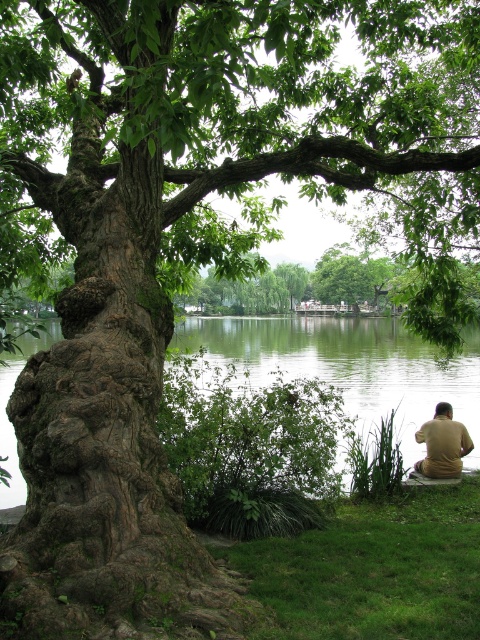
Question: Based on their relative distances, which object is nearer to the brown wooden bench at lower right?

Choices:
 (A) green grass at lower right
 (B) brown cotton shirt at lower right
 (C) green liquid water at center

Answer: (B)

Question: Which object is positioned closest to the brown cotton shirt at lower right?

Choices:
 (A) green grass at lower right
 (B) green liquid water at center
 (C) brown wooden bench at lower right

Answer: (C)

Question: Does green grass at lower right have a greater width compared to brown cotton shirt at lower right?

Choices:
 (A) yes
 (B) no

Answer: (A)

Question: Is green liquid water at center closer to camera compared to brown cotton shirt at lower right?

Choices:
 (A) yes
 (B) no

Answer: (B)

Question: Observing the image, what is the correct spatial positioning of green grass at lower right in reference to brown cotton shirt at lower right?

Choices:
 (A) below
 (B) above

Answer: (A)

Question: Which point is farther to the camera?

Choices:
 (A) green grass at lower right
 (B) brown wooden bench at lower right
 (C) brown cotton shirt at lower right

Answer: (C)